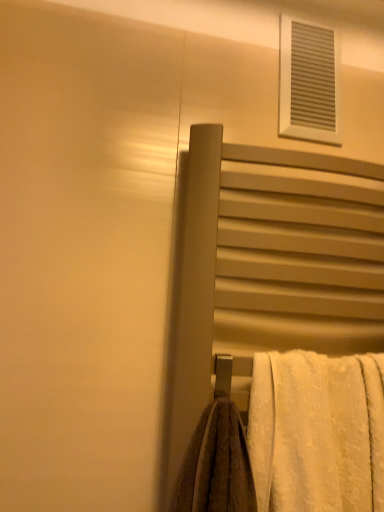
Question: Considering the positions of white fluffy towel at lower right and white textured vent at upper right in the image, is white fluffy towel at lower right wider or thinner than white textured vent at upper right?

Choices:
 (A) wide
 (B) thin

Answer: (A)

Question: From the image's perspective, relative to white textured vent at upper right, is white fluffy towel at lower right above or below?

Choices:
 (A) below
 (B) above

Answer: (A)

Question: Estimate the real-world distances between objects in this image. Which object is farther from the white fluffy towel at lower right?

Choices:
 (A) matte gray towel rack at center-right
 (B) white textured vent at upper right

Answer: (B)

Question: Which is nearer to the white fluffy towel at lower right?

Choices:
 (A) matte gray towel rack at center-right
 (B) white textured vent at upper right

Answer: (A)